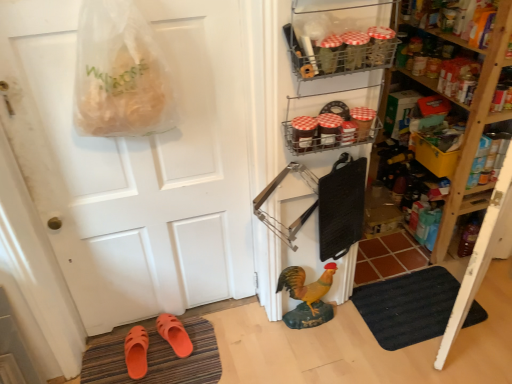
Question: Considering the positions of white matte door at center and metallic wire rack at upper center, which is the second shelf from left to right, in the image, is white matte door at center bigger or smaller than metallic wire rack at upper center, which is the second shelf from left to right,?

Choices:
 (A) small
 (B) big

Answer: (B)

Question: From a real-world perspective, is white matte door at center above or below metallic wire rack at upper center, marked as the 2th shelf in a front-to-back arrangement?

Choices:
 (A) below
 (B) above

Answer: (A)

Question: Estimate the real-world distances between objects in this image. Which object is farther from the orange rubber slippers at lower left, the first footwear when ordered from left to right?

Choices:
 (A) clear plastic grocery bag at upper left
 (B) orange rubber slippers at lower left, which is the second footwear from left to right
 (C) orange rubber doormat at lower left, arranged as the first doormat when viewed from the left
 (D) wooden shelves at right, which appears as the third shelf when viewed from the left
 (E) metallic wire rack at upper right, the 1th shelf viewed from the front

Answer: (D)

Question: Considering the real-world distances, which object is farthest from the orange rubber slippers at lower left, which ranks as the 2th footwear in right-to-left order?

Choices:
 (A) wooden shelves at right, marked as the first shelf in a back-to-front arrangement
 (B) clear plastic grocery bag at upper left
 (C) white matte door at center
 (D) metallic wire rack at upper right, which is the 3th shelf from right to left
 (E) black rubber doormat at lower right, the first doormat positioned from the right

Answer: (A)